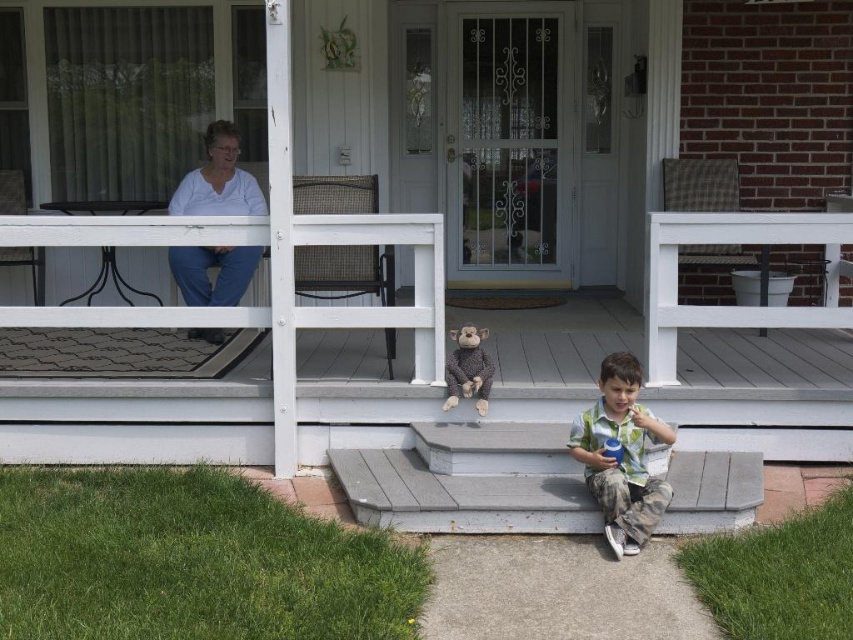
Question: Among these points, which one is nearest to the camera?

Choices:
 (A) (61, 310)
 (B) (635, 403)
 (C) (543, 444)

Answer: (B)

Question: Which of the following is the closest to the observer?

Choices:
 (A) white wooden porch at center
 (B) gray concrete stairs at lower center
 (C) white cotton shirt at upper left

Answer: (B)

Question: Does white wooden porch at center lie in front of gray concrete stairs at lower center?

Choices:
 (A) no
 (B) yes

Answer: (A)

Question: Estimate the real-world distances between objects in this image. Which object is closer to the green cotton shirt at lower center?

Choices:
 (A) white cotton shirt at upper left
 (B) gray concrete stairs at lower center
 (C) white wooden porch at center

Answer: (B)

Question: Is white wooden porch at center wider than white cotton shirt at upper left?

Choices:
 (A) yes
 (B) no

Answer: (A)

Question: Does gray concrete stairs at lower center have a greater width compared to white cotton shirt at upper left?

Choices:
 (A) no
 (B) yes

Answer: (B)